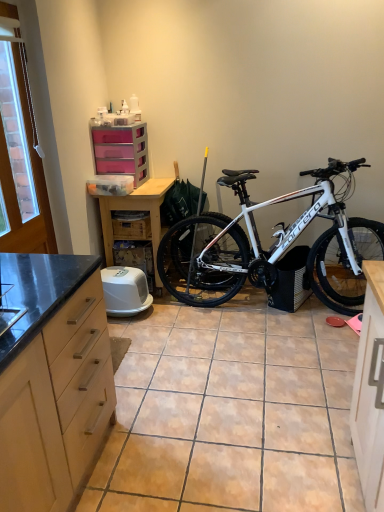
The image size is (384, 512). What are the coordinates of `vacant space to the right of white plastic litter box at center` in the screenshot? It's located at (174, 318).